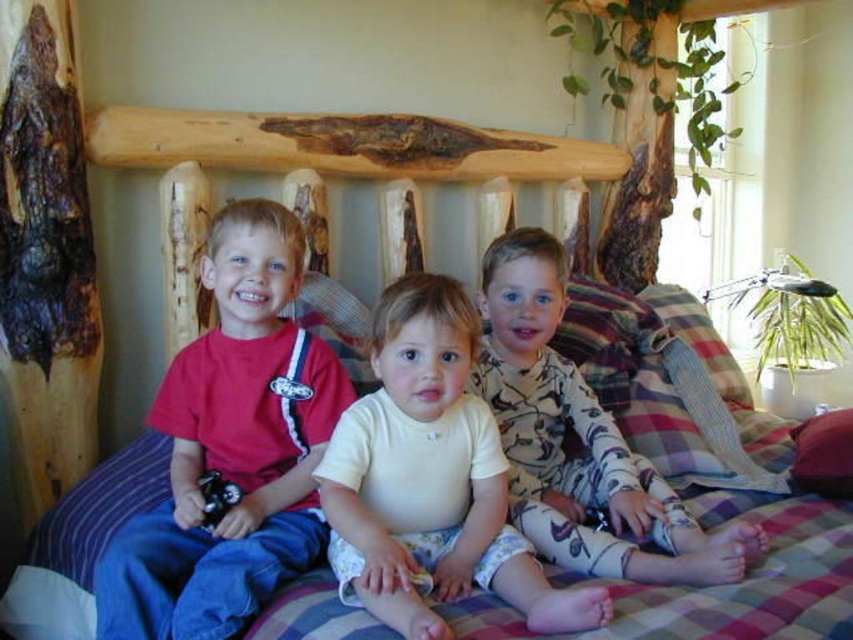
Question: Which point is closer to the camera?

Choices:
 (A) (198, 365)
 (B) (570, 563)
 (C) (412, 579)
 (D) (822, 422)

Answer: (C)

Question: Which of the following is the farthest from the observer?

Choices:
 (A) (157, 404)
 (B) (816, 458)

Answer: (B)

Question: In this image, where is matte red t-shirt at left located relative to purple fabric pillow at center?

Choices:
 (A) left
 (B) right

Answer: (A)

Question: Does matte red t-shirt at left have a smaller size compared to purple fabric pillow at center?

Choices:
 (A) yes
 (B) no

Answer: (B)

Question: Estimate the real-world distances between objects in this image. Which object is closer to the matte red t-shirt at left?

Choices:
 (A) purple fabric pillow at center
 (B) camouflage pajamas at center

Answer: (B)

Question: Is matte red t-shirt at left to the left of camouflage pajamas at center from the viewer's perspective?

Choices:
 (A) yes
 (B) no

Answer: (A)